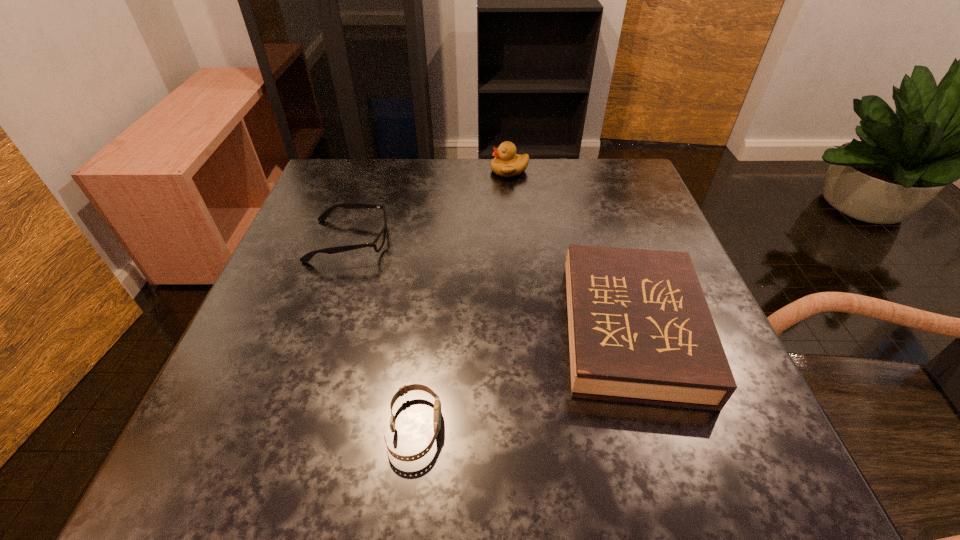
This screenshot has height=540, width=960. In order to click on vacant area that satisfies the following two spatial constraints: 1. at the beak of the tallest object; 2. on the back side of the second tallest object in this screenshot , I will do `click(524, 329)`.